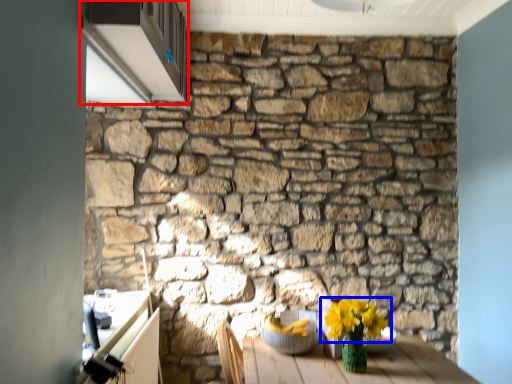
Question: Which object is further to the camera taking this photo, window (highlighted by a red box) or flower (highlighted by a blue box)?

Choices:
 (A) window
 (B) flower

Answer: (B)